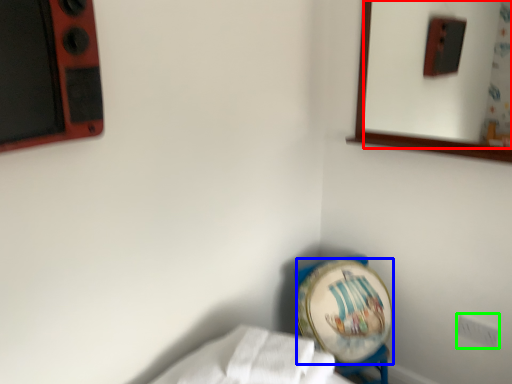
Question: Estimate the real-world distances between objects in this image. Which object is closer to mirror (highlighted by a red box), platter (highlighted by a blue box) or electric outlet (highlighted by a green box)?

Choices:
 (A) platter
 (B) electric outlet

Answer: (A)